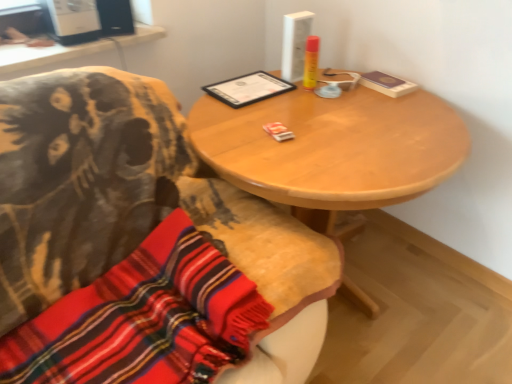
Measure the distance between point (143, 255) and camera.

They are 1.24 meters apart.

Where is `wooden table at center`? The height and width of the screenshot is (384, 512). wooden table at center is located at coordinates (332, 149).

This screenshot has height=384, width=512. I want to click on white plastic computer desk at upper left, so click(x=68, y=52).

Is point (297, 258) positioned in front of point (247, 280)?

No, (297, 258) is further to viewer.

From the picture: From the image's perspective, relative to knitted wool scarf at lower left, is wooden chair at center above or below?

From the image's perspective, wooden chair at center appears above knitted wool scarf at lower left.

Is wooden chair at center to the right of knitted wool scarf at lower left from the viewer's perspective?

Yes, wooden chair at center is to the right of knitted wool scarf at lower left.

Is wooden chair at center facing towards knitted wool scarf at lower left?

Yes.

Choose the correct answer: Is white plastic computer desk at upper left inside wooden table at center or outside it?

white plastic computer desk at upper left is not enclosed by wooden table at center.

From a real-world perspective, is white plastic computer desk at upper left physically located above or below wooden table at center?

white plastic computer desk at upper left is above wooden table at center.

Is white plastic computer desk at upper left aimed at wooden table at center?

No.

From the picture: From a real-world perspective, who is located higher, wooden table at center or knitted wool scarf at lower left?

knitted wool scarf at lower left.

Is knitted wool scarf at lower left a part of wooden table at center?

No, knitted wool scarf at lower left is located outside of wooden table at center.

Is point (243, 130) positioned after point (152, 262)?

Yes, it is.

Is wooden table at center in front of or behind knitted wool scarf at lower left in the image?

wooden table at center is behind knitted wool scarf at lower left.

Based on their sizes in the image, would you say wooden table at center is bigger or smaller than white plastic computer desk at upper left?

Considering their sizes, wooden table at center takes up more space than white plastic computer desk at upper left.

From a real-world perspective, between wooden table at center and white plastic computer desk at upper left, who is vertically lower?

wooden table at center is physically lower.

Which object is closer to the camera, wooden table at center or white plastic computer desk at upper left?

Positioned in front is wooden table at center.

Locate an element on the screen. computer desk above the wooden table at center (from the image's perspective) is located at coordinates (68, 52).

Looking at this image, is knitted wool scarf at lower left wider than wooden table at center?

Incorrect, the width of knitted wool scarf at lower left does not surpass that of wooden table at center.

Considering the sizes of objects knitted wool scarf at lower left and wooden table at center in the image provided, who is bigger, knitted wool scarf at lower left or wooden table at center?

With larger size is wooden table at center.

Considering the relative sizes of knitted wool scarf at lower left and wooden table at center in the image provided, is knitted wool scarf at lower left shorter than wooden table at center?

Indeed, knitted wool scarf at lower left has a lesser height compared to wooden table at center.

Is knitted wool scarf at lower left far away from wooden table at center?

That's not correct — knitted wool scarf at lower left is a little close to wooden table at center.

Is wooden chair at center beside wooden table at center?

There is a gap between wooden chair at center and wooden table at center.

From a real-world perspective, which is physically below, wooden chair at center or wooden table at center?

wooden table at center, from a real-world perspective.

Which object is wider, wooden chair at center or wooden table at center?

wooden table at center.

Would you say knitted wool scarf at lower left is to the left or to the right of white plastic computer desk at upper left in the picture?

knitted wool scarf at lower left is to the right of white plastic computer desk at upper left.

From the image's perspective, is knitted wool scarf at lower left located above or below white plastic computer desk at upper left?

Clearly, from the image's perspective, knitted wool scarf at lower left is below white plastic computer desk at upper left.

Can you confirm if knitted wool scarf at lower left is shorter than white plastic computer desk at upper left?

In fact, knitted wool scarf at lower left may be taller than white plastic computer desk at upper left.

Is point (15, 380) in front of point (11, 61)?

That is True.

The image size is (512, 384). Find the location of `cloth positioned vertically above the wooden chair at center (from a real-world perspective)`. cloth positioned vertically above the wooden chair at center (from a real-world perspective) is located at coordinates tap(144, 319).

Find the location of a particular element. desk located below the white plastic computer desk at upper left (from the image's perspective) is located at coordinates (332, 149).

Which object lies nearer to the anchor point white plastic computer desk at upper left, wooden table at center or knitted wool scarf at lower left?

Based on the image, wooden table at center appears to be nearer to white plastic computer desk at upper left.

From the image, which object appears to be nearer to wooden chair at center, wooden table at center or white plastic computer desk at upper left?

wooden table at center is positioned closer to the anchor wooden chair at center.

From the image, which object appears to be nearer to white plastic computer desk at upper left, knitted wool scarf at lower left or wooden table at center?

The object closer to white plastic computer desk at upper left is wooden table at center.

Based on the photo, when comparing their distances from white plastic computer desk at upper left, does knitted wool scarf at lower left or wooden chair at center seem closer?

The object closer to white plastic computer desk at upper left is wooden chair at center.

From the picture: Looking at the image, which one is located closer to knitted wool scarf at lower left, wooden chair at center or wooden table at center?

wooden chair at center lies closer to knitted wool scarf at lower left than the other object.

Looking at the image, which one is located closer to wooden chair at center, knitted wool scarf at lower left or white plastic computer desk at upper left?

Based on the image, knitted wool scarf at lower left appears to be nearer to wooden chair at center.

When comparing their distances from wooden table at center, does wooden chair at center or white plastic computer desk at upper left seem closer?

wooden chair at center is closer to wooden table at center.

Based on their spatial positions, is knitted wool scarf at lower left or white plastic computer desk at upper left closer to wooden table at center?

The object closer to wooden table at center is knitted wool scarf at lower left.

Locate an element on the screen. The width and height of the screenshot is (512, 384). desk between white plastic computer desk at upper left and knitted wool scarf at lower left from top to bottom is located at coordinates (332, 149).

Locate an element on the screen. chair situated between knitted wool scarf at lower left and wooden table at center from left to right is located at coordinates (140, 246).

Identify the location of chair situated between white plastic computer desk at upper left and wooden table at center from left to right. This screenshot has width=512, height=384. (140, 246).

The image size is (512, 384). I want to click on chair between white plastic computer desk at upper left and knitted wool scarf at lower left from top to bottom, so click(x=140, y=246).